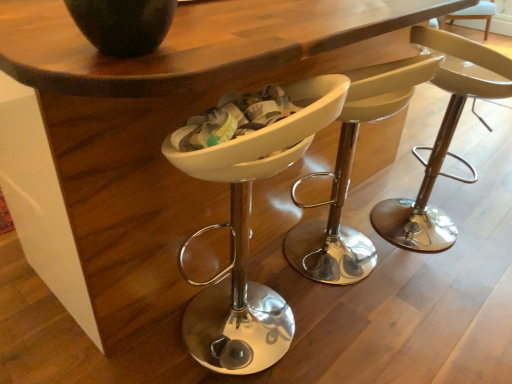
This screenshot has width=512, height=384. What are the coordinates of `unoccupied region to the right of white plastic chair at center, the 2th chair when ordered from right to left` in the screenshot? It's located at (444, 285).